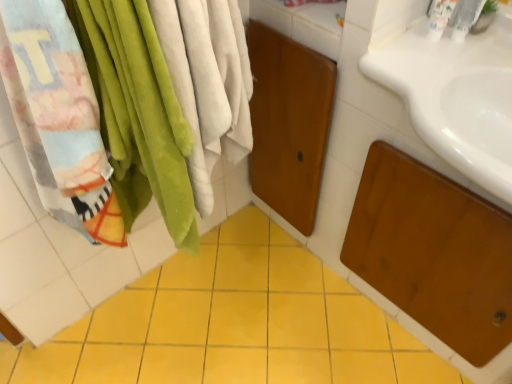
Question: Is white plastic faucet at upper right, placed as the 2th toiletry when sorted from left to right, wider or thinner than white plastic bottle at upper right, the first toiletry when ordered from left to right?

Choices:
 (A) thin
 (B) wide

Answer: (A)

Question: Is white plastic faucet at upper right, placed as the 2th toiletry when sorted from left to right, taller or shorter than white plastic bottle at upper right, positioned as the second toiletry in right-to-left order?

Choices:
 (A) short
 (B) tall

Answer: (B)

Question: Which object is the closest to the white plastic faucet at upper right, the first toiletry positioned from the right?

Choices:
 (A) white plastic bottle at upper right, the first toiletry when ordered from left to right
 (B) yellow ceramic tile at center

Answer: (A)

Question: Estimate the real-world distances between objects in this image. Which object is closer to the white plastic faucet at upper right, the first toiletry positioned from the right?

Choices:
 (A) yellow ceramic tile at center
 (B) white plastic bottle at upper right, positioned as the second toiletry in right-to-left order

Answer: (B)